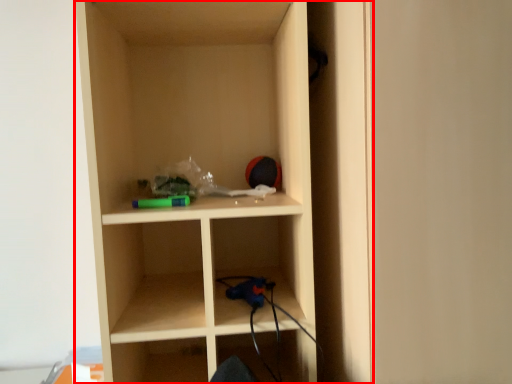
Question: Considering the relative positions of shelf (annotated by the red box) and door in the image provided, where is shelf (annotated by the red box) located with respect to the staircase?

Choices:
 (A) right
 (B) left

Answer: (B)